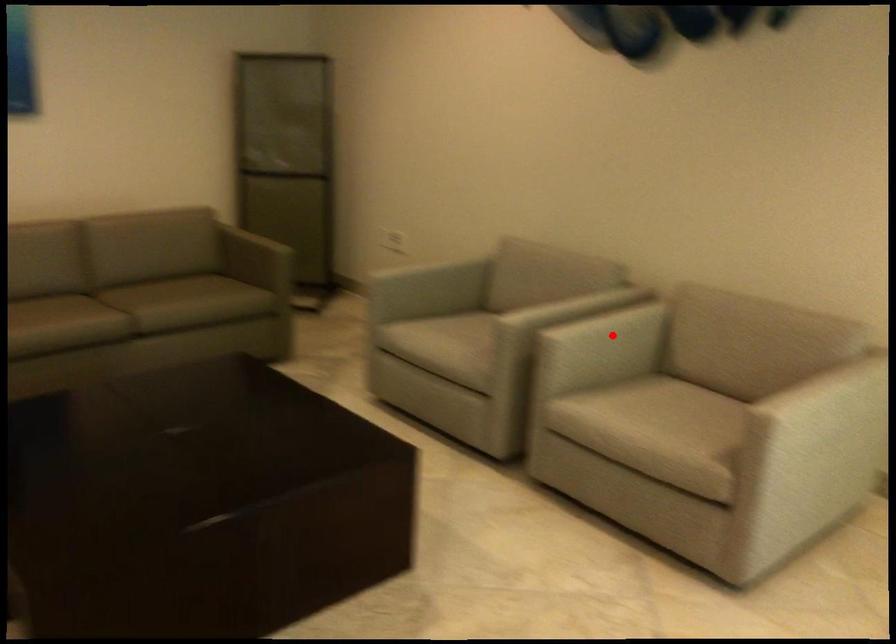
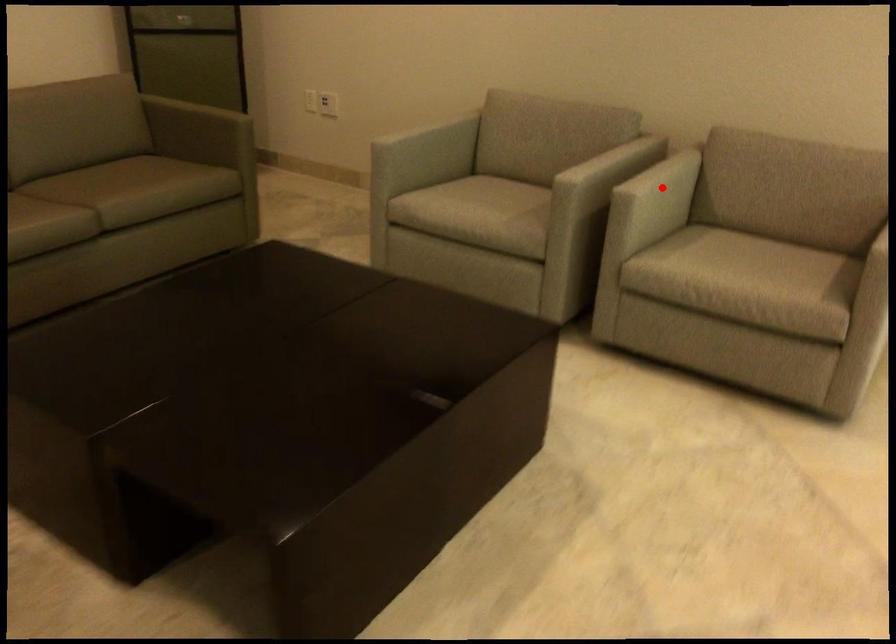
I am providing you with two images of the same scene from different viewpoints. A red point is marked on the first image and another point is marked on the second image. Is the marked point in image1 the same physical position as the marked point in image2?

Yes